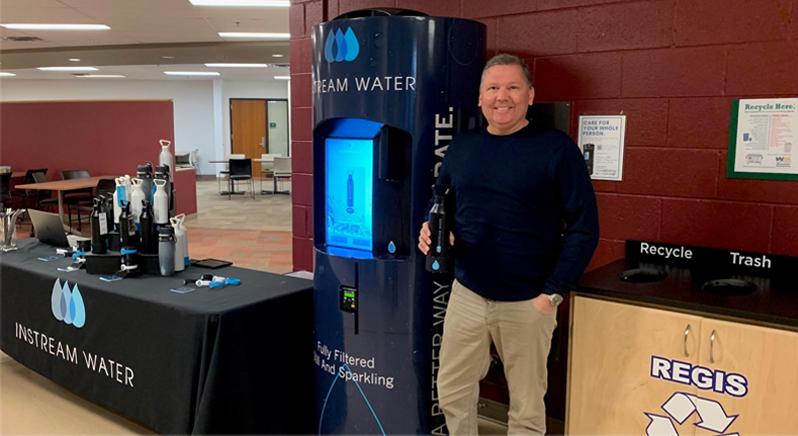
I want to click on brick wall, so click(x=688, y=151).